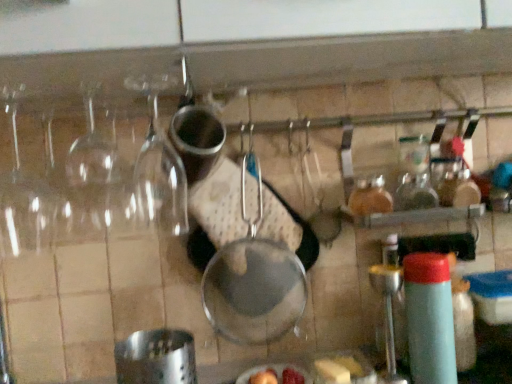
Question: Should I look upward or downward to see yellow butter at lower right?

Choices:
 (A) down
 (B) up

Answer: (A)

Question: Is metallic silver frying pan at center completely or partially inside yellow butter at lower right?

Choices:
 (A) no
 (B) yes

Answer: (A)

Question: Is yellow butter at lower right further to camera compared to metallic silver frying pan at center?

Choices:
 (A) no
 (B) yes

Answer: (A)

Question: Would you consider yellow butter at lower right to be distant from metallic silver frying pan at center?

Choices:
 (A) no
 (B) yes

Answer: (A)

Question: Does yellow butter at lower right appear on the left side of metallic silver frying pan at center?

Choices:
 (A) yes
 (B) no

Answer: (B)

Question: Does yellow butter at lower right have a greater width compared to metallic silver frying pan at center?

Choices:
 (A) no
 (B) yes

Answer: (B)

Question: From a real-world perspective, is yellow butter at lower right positioned under metallic silver frying pan at center based on gravity?

Choices:
 (A) no
 (B) yes

Answer: (B)

Question: Is light blue plastic bottle at right bigger than metallic silver frying pan at center?

Choices:
 (A) yes
 (B) no

Answer: (B)

Question: Does light blue plastic bottle at right come in front of metallic silver frying pan at center?

Choices:
 (A) no
 (B) yes

Answer: (B)

Question: Considering the relative positions of light blue plastic bottle at right and metallic silver frying pan at center in the image provided, is light blue plastic bottle at right behind metallic silver frying pan at center?

Choices:
 (A) yes
 (B) no

Answer: (B)

Question: Can you confirm if light blue plastic bottle at right is smaller than metallic silver frying pan at center?

Choices:
 (A) no
 (B) yes

Answer: (B)

Question: From the image's perspective, is light blue plastic bottle at right beneath metallic silver frying pan at center?

Choices:
 (A) no
 (B) yes

Answer: (B)

Question: Does light blue plastic bottle at right have a lesser height compared to metallic silver frying pan at center?

Choices:
 (A) no
 (B) yes

Answer: (B)

Question: Is yellow butter at lower right positioned in front of light blue plastic bottle at right?

Choices:
 (A) yes
 (B) no

Answer: (B)